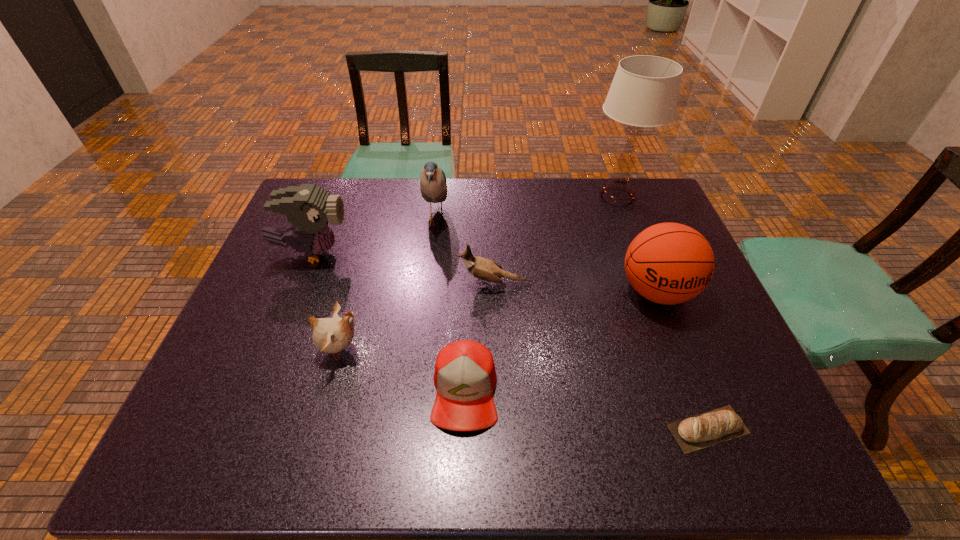
I want to click on table lamp situated at the far edge, so click(x=644, y=92).

Where is `bird that is at the far edge`? The height and width of the screenshot is (540, 960). bird that is at the far edge is located at coordinates (433, 186).

You are a GUI agent. You are given a task and a screenshot of the screen. Output one action in this format:
    pyautogui.click(x=<x>, y=<y>)
    Task: Click on the baseball cap at the near edge
    
    Given the screenshot: What is the action you would take?
    (465, 377)

You are a GUI agent. You are given a task and a screenshot of the screen. Output one action in this format:
    pyautogui.click(x=<x>, y=<y>)
    Task: Click on the pita bread present at the near edge
    The height and width of the screenshot is (540, 960).
    Given the screenshot: What is the action you would take?
    pyautogui.click(x=710, y=428)

I want to click on object present at the left edge, so click(309, 208).

The width and height of the screenshot is (960, 540). What are the coordinates of `table lamp that is at the right edge` in the screenshot? It's located at (644, 92).

This screenshot has width=960, height=540. In order to click on basketball located in the right edge section of the desktop in this screenshot , I will do `click(668, 263)`.

This screenshot has height=540, width=960. Identify the location of pita bread that is positioned at the right edge. (710, 428).

Identify the location of object at the far right corner. The width and height of the screenshot is (960, 540). 644,92.

You are a GUI agent. You are given a task and a screenshot of the screen. Output one action in this format:
    pyautogui.click(x=<x>, y=<y>)
    Task: Click on the object positioned at the near right corner
    This screenshot has height=540, width=960.
    Given the screenshot: What is the action you would take?
    pyautogui.click(x=710, y=428)